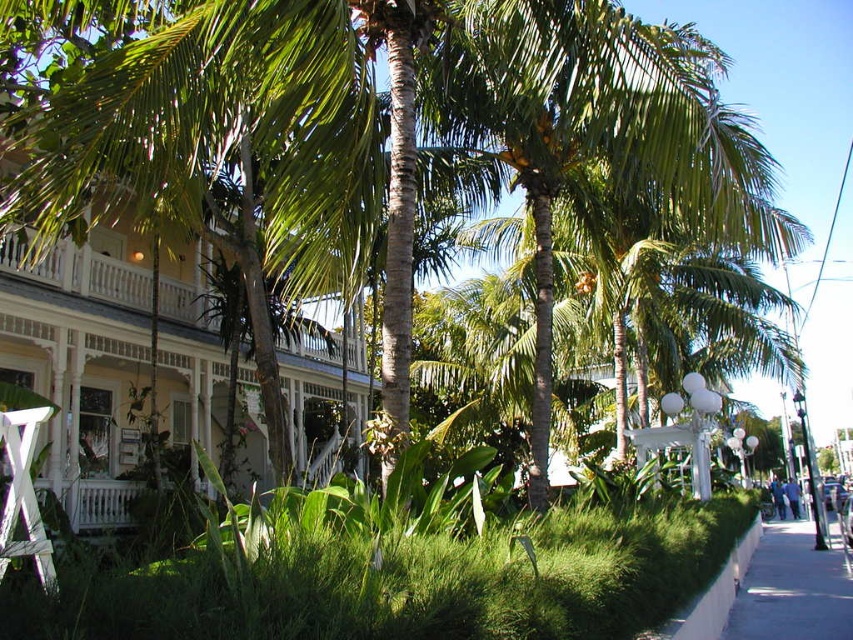
Is green leafy grass at lower center above blue fabric person at lower right?

Yes, green leafy grass at lower center is above blue fabric person at lower right.

The image size is (853, 640). What do you see at coordinates (408, 584) in the screenshot?
I see `green leafy grass at lower center` at bounding box center [408, 584].

Locate an element on the screen. This screenshot has height=640, width=853. green leafy grass at lower center is located at coordinates (408, 584).

Who is more forward, (787, 572) or (788, 493)?

Point (787, 572) is in front.

Which is more to the right, gray concrete sidewalk at lower right or blue cotton shirt at lower right?

blue cotton shirt at lower right

I want to click on gray concrete sidewalk at lower right, so click(x=792, y=589).

Locate an element on the screen. gray concrete sidewalk at lower right is located at coordinates (792, 589).

Can you confirm if blue fabric person at lower right is taller than blue cotton shirt at lower right?

Correct, blue fabric person at lower right is much taller as blue cotton shirt at lower right.

Can you confirm if blue fabric person at lower right is smaller than blue cotton shirt at lower right?

No, blue fabric person at lower right is not smaller than blue cotton shirt at lower right.

The image size is (853, 640). In order to click on blue fabric person at lower right in this screenshot , I will do `click(776, 496)`.